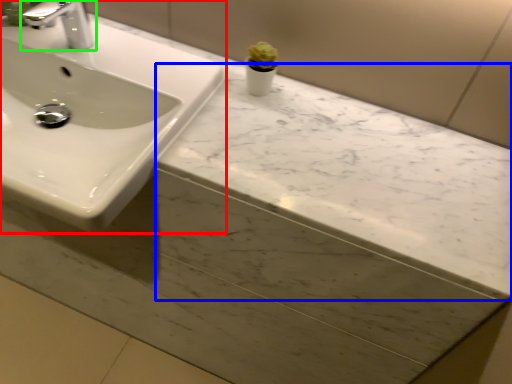
Question: Estimate the real-world distances between objects in this image. Which object is closer to sink (highlighted by a red box), counter top (highlighted by a blue box) or tap (highlighted by a green box)?

Choices:
 (A) counter top
 (B) tap

Answer: (B)